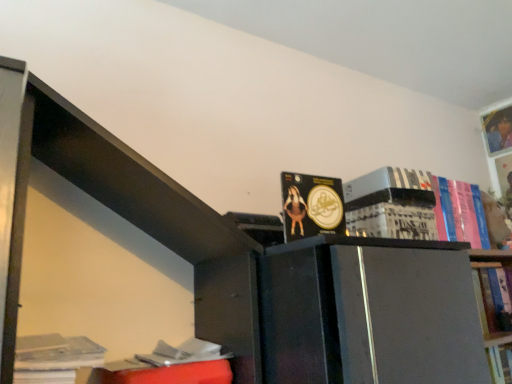
Question: Should I look upward or downward to see white paper stack at lower left, which appears as the first book when viewed from the left?

Choices:
 (A) up
 (B) down

Answer: (B)

Question: Does white paper at center, the second paperback book positioned from the top, lie behind matte gold coin at center, the 2th book positioned from the front?

Choices:
 (A) yes
 (B) no

Answer: (A)

Question: Considering the relative sizes of white paper at center, the second paperback book positioned from the top, and matte gold coin at center, the 2th book from the left, in the image provided, is white paper at center, the second paperback book positioned from the top, thinner than matte gold coin at center, the 2th book from the left,?

Choices:
 (A) no
 (B) yes

Answer: (A)

Question: Considering the relative sizes of white paper at center, the first paperback book ordered from the bottom, and matte gold coin at center, the 4th book when ordered from right to left, in the image provided, is white paper at center, the first paperback book ordered from the bottom, bigger than matte gold coin at center, the 4th book when ordered from right to left,?

Choices:
 (A) no
 (B) yes

Answer: (B)

Question: Does white paper at center, the second paperback book positioned from the top, touch matte gold coin at center, the 2th book from the left?

Choices:
 (A) yes
 (B) no

Answer: (B)

Question: Is white paper at center, the second paperback book positioned from the top, at the left side of matte gold coin at center, the 4th book when ordered from right to left?

Choices:
 (A) yes
 (B) no

Answer: (B)

Question: Is white paper at center, the second paperback book positioned from the top, positioned with its back to matte gold coin at center, the 2th book from the left?

Choices:
 (A) no
 (B) yes

Answer: (A)

Question: Would you say hardcover book at upper right, marked as the fifth book in a front-to-back arrangement, is outside white paper stack at lower left, which appears as the 1th book when viewed from the front?

Choices:
 (A) no
 (B) yes

Answer: (B)

Question: Considering the relative sizes of hardcover book at upper right, the first book viewed from the right, and white paper stack at lower left, which appears as the first book when viewed from the left, in the image provided, is hardcover book at upper right, the first book viewed from the right, shorter than white paper stack at lower left, which appears as the first book when viewed from the left,?

Choices:
 (A) no
 (B) yes

Answer: (A)

Question: Is the position of hardcover book at upper right, the 5th book in the left-to-right sequence, less distant than that of white paper stack at lower left, the fifth book when ordered from right to left?

Choices:
 (A) no
 (B) yes

Answer: (A)

Question: From the image's perspective, is hardcover book at upper right, marked as the fifth book in a front-to-back arrangement, beneath white paper stack at lower left, which appears as the first book when viewed from the left?

Choices:
 (A) yes
 (B) no

Answer: (B)

Question: Does hardcover book at upper right, the 1th book viewed from the back, have a greater width compared to white paper stack at lower left, which ranks as the fifth book in back-to-front order?

Choices:
 (A) yes
 (B) no

Answer: (B)

Question: Does hardcover book at upper right, the first book viewed from the right, appear on the right side of white paper stack at lower left, the fifth book when ordered from right to left?

Choices:
 (A) yes
 (B) no

Answer: (A)

Question: Can you confirm if black matte book at upper right, the 2th paperback book when ordered from bottom to top, is positioned to the left of matte gold coin at center, the 4th book when ordered from right to left?

Choices:
 (A) no
 (B) yes

Answer: (A)